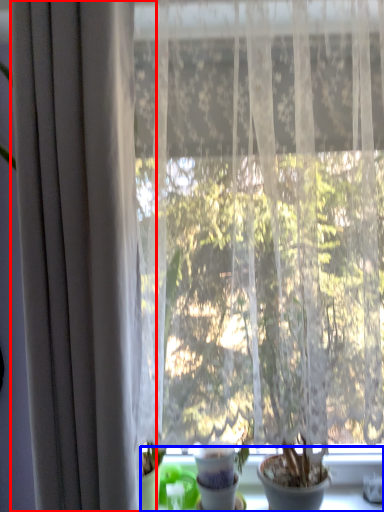
Question: Which object is further to the camera taking this photo, curtain (highlighted by a red box) or window sill (highlighted by a blue box)?

Choices:
 (A) curtain
 (B) window sill

Answer: (B)